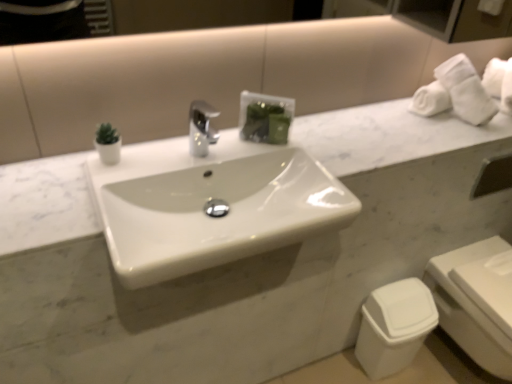
Question: Does white plastic toilet at lower right have a smaller size compared to white glossy sink at center?

Choices:
 (A) no
 (B) yes

Answer: (A)

Question: Does white plastic toilet at lower right appear on the left side of white glossy sink at center?

Choices:
 (A) yes
 (B) no

Answer: (B)

Question: Is white plastic toilet at lower right in contact with white glossy sink at center?

Choices:
 (A) yes
 (B) no

Answer: (B)

Question: Is white plastic toilet at lower right further to camera compared to white glossy sink at center?

Choices:
 (A) no
 (B) yes

Answer: (B)

Question: Is white plastic toilet at lower right far from white glossy sink at center?

Choices:
 (A) yes
 (B) no

Answer: (B)

Question: Relative to white plastic toilet bowl at lower right, is white glossy sink at center in front or behind?

Choices:
 (A) behind
 (B) front

Answer: (B)

Question: Considering the positions of point (248, 147) and point (361, 334), is point (248, 147) closer or farther from the camera than point (361, 334)?

Choices:
 (A) closer
 (B) farther

Answer: (A)

Question: From a real-world perspective, is white glossy sink at center above or below white plastic toilet bowl at lower right?

Choices:
 (A) below
 (B) above

Answer: (B)

Question: Looking at the image, does white glossy sink at center seem bigger or smaller compared to white plastic toilet bowl at lower right?

Choices:
 (A) big
 (B) small

Answer: (A)

Question: Choose the correct answer: Is white plastic toilet bowl at lower right inside white plastic toilet at lower right or outside it?

Choices:
 (A) inside
 (B) outside

Answer: (B)

Question: Considering the positions of white plastic toilet bowl at lower right and white plastic toilet at lower right in the image, is white plastic toilet bowl at lower right bigger or smaller than white plastic toilet at lower right?

Choices:
 (A) big
 (B) small

Answer: (B)

Question: Is white plastic toilet bowl at lower right taller or shorter than white plastic toilet at lower right?

Choices:
 (A) tall
 (B) short

Answer: (B)

Question: Considering the relative positions of white plastic toilet bowl at lower right and white plastic toilet at lower right in the image provided, is white plastic toilet bowl at lower right to the left or to the right of white plastic toilet at lower right?

Choices:
 (A) right
 (B) left

Answer: (B)

Question: Considering the positions of point (492, 324) and point (426, 306), is point (492, 324) closer or farther from the camera than point (426, 306)?

Choices:
 (A) closer
 (B) farther

Answer: (A)

Question: Considering the relative positions of white plastic toilet at lower right and white plastic toilet bowl at lower right in the image provided, is white plastic toilet at lower right to the left or to the right of white plastic toilet bowl at lower right?

Choices:
 (A) right
 (B) left

Answer: (A)